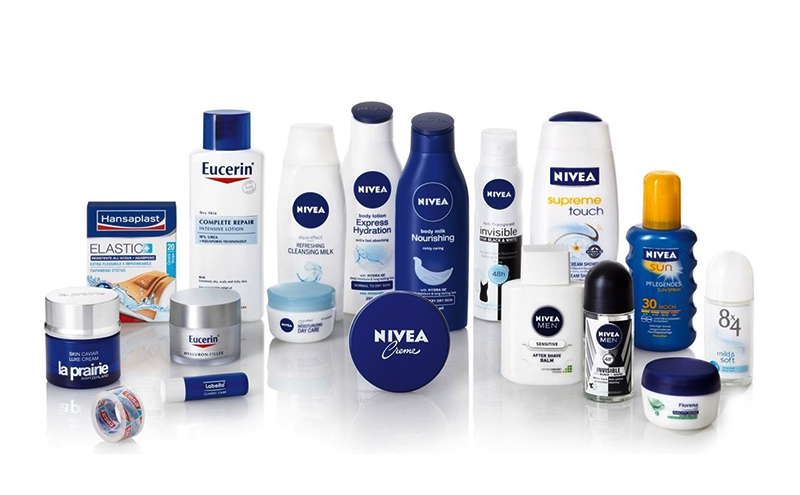
Locate an element on the screen. bottles is located at coordinates (218, 200), (306, 192), (372, 162), (438, 183), (510, 191), (568, 166), (666, 267), (534, 312).